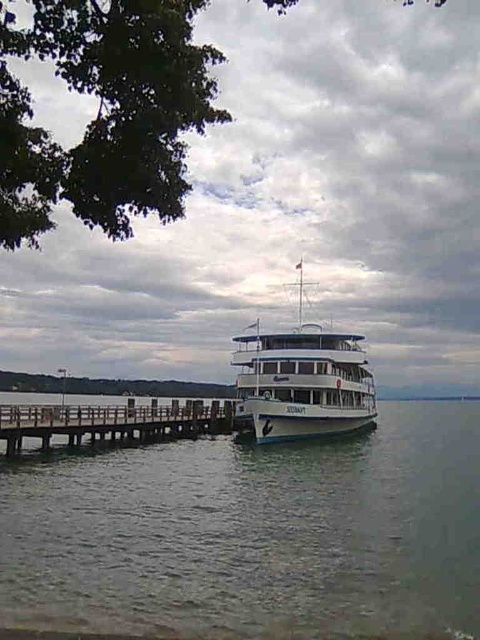
From the picture: You are a photographer planning to capture the white glossy cruise ship at center from the dock. You notice the clear water at dock right. Which object is taller between the two?

The white glossy cruise ship at center is taller than the clear water at dock right.

You are a photographer planning to capture the white glossy cruise ship at center and the brown wooden dock at lower left in a single shot. Based on their widths, which one should you frame first to ensure both fit in the photo?

The white glossy cruise ship at center is thinner than the brown wooden dock at lower left, so you should frame the brown wooden dock at lower left first since it is wider and requires more space in the composition.